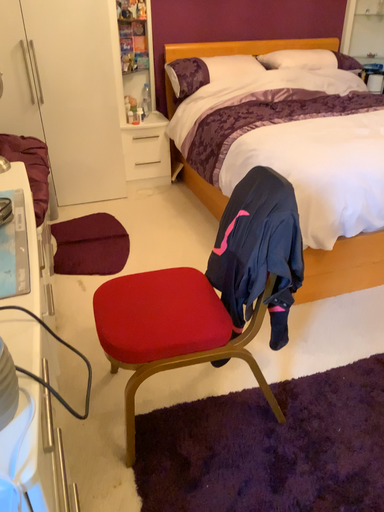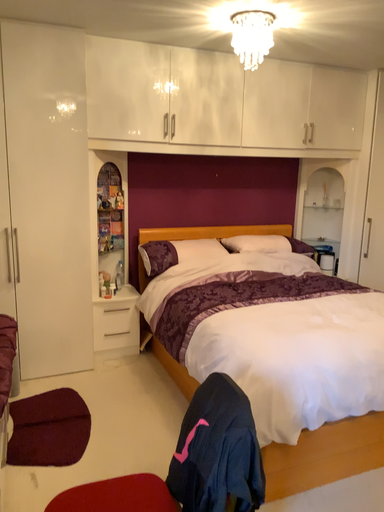
Question: Which way did the camera rotate in the video?

Choices:
 (A) rotated downward
 (B) rotated upward

Answer: (B)